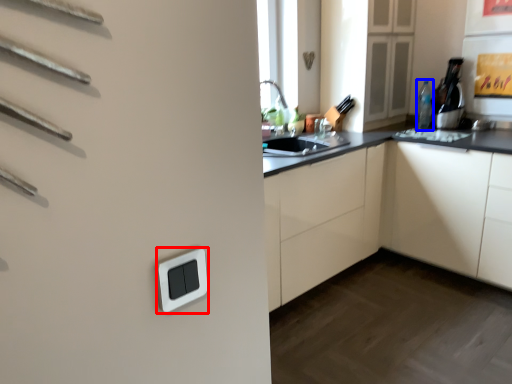
Question: Which object is further to the camera taking this photo, light switch (highlighted by a red box) or bottle (highlighted by a blue box)?

Choices:
 (A) light switch
 (B) bottle

Answer: (B)